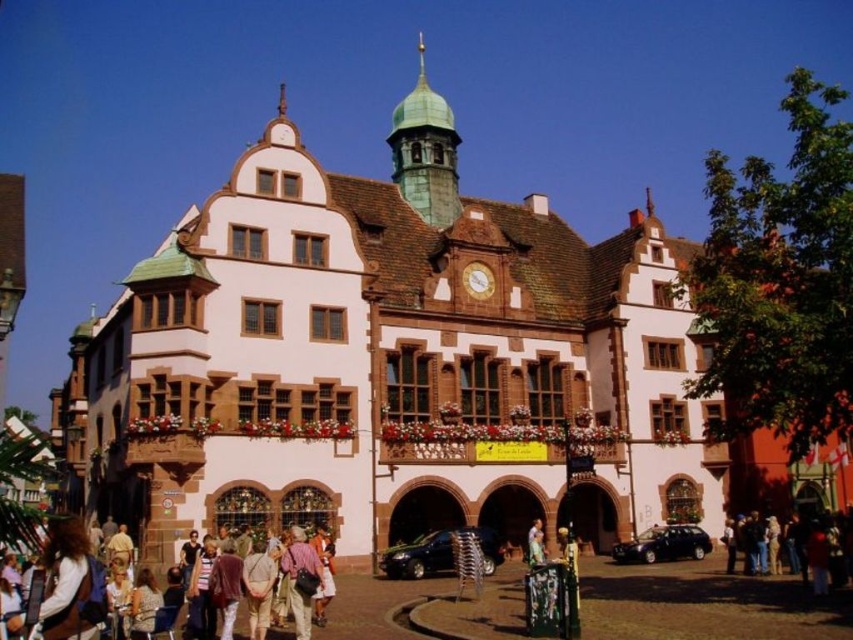
Question: Among these points, which one is farthest from the camera?

Choices:
 (A) (403, 145)
 (B) (91, 616)

Answer: (A)

Question: Estimate the real-world distances between objects in this image. Which object is farther from the green copper bell tower at upper center?

Choices:
 (A) light brown leather jacket at center
 (B) light brown leather jacket at lower left

Answer: (B)

Question: Does green copper bell tower at upper center have a larger size compared to light brown leather jacket at lower left?

Choices:
 (A) yes
 (B) no

Answer: (A)

Question: In this image, where is light brown leather jacket at lower left located relative to light brown leather jacket at center?

Choices:
 (A) right
 (B) left

Answer: (B)

Question: Estimate the real-world distances between objects in this image. Which object is closer to the light brown leather jacket at lower left?

Choices:
 (A) light brown leather jacket at center
 (B) green copper bell tower at upper center

Answer: (A)

Question: Does light brown leather jacket at lower left lie behind light brown leather jacket at center?

Choices:
 (A) yes
 (B) no

Answer: (B)